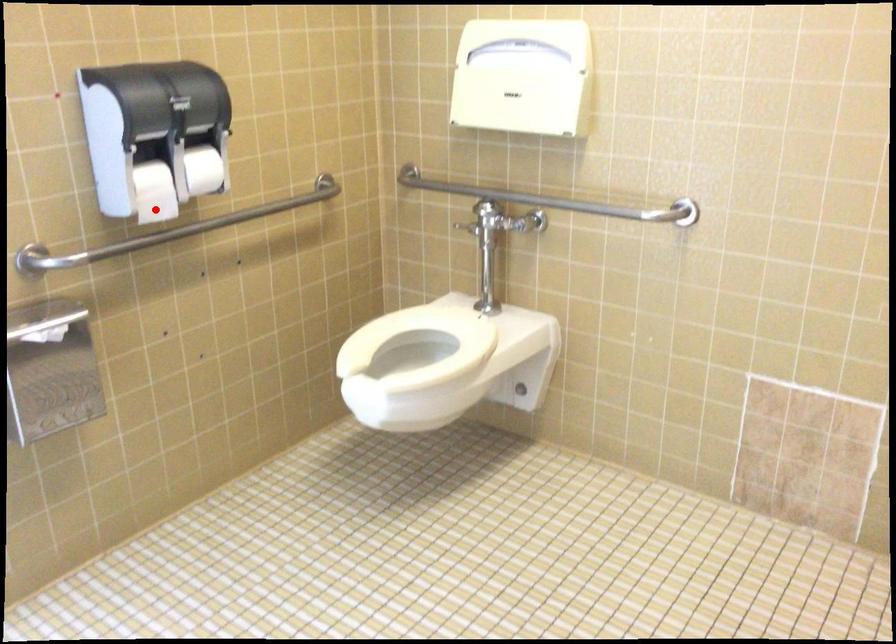
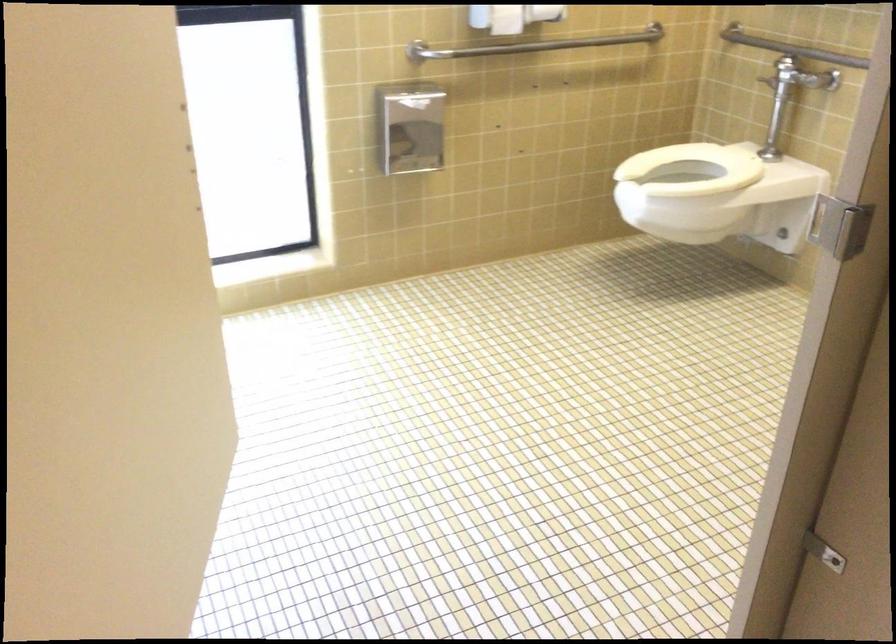
Find the pixel in the second image that matches the highlighted location in the first image.

(506, 20)